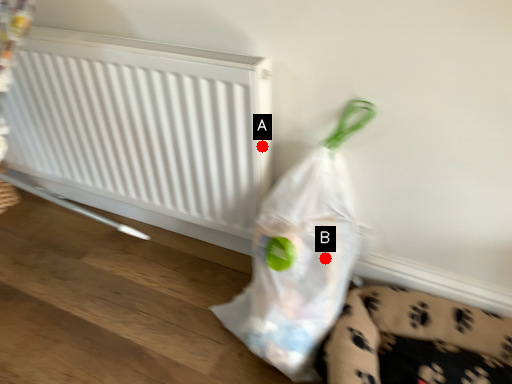
Question: Two points are circled on the image, labeled by A and B beside each circle. Which point is closer to the camera?

Choices:
 (A) A is closer
 (B) B is closer

Answer: (B)